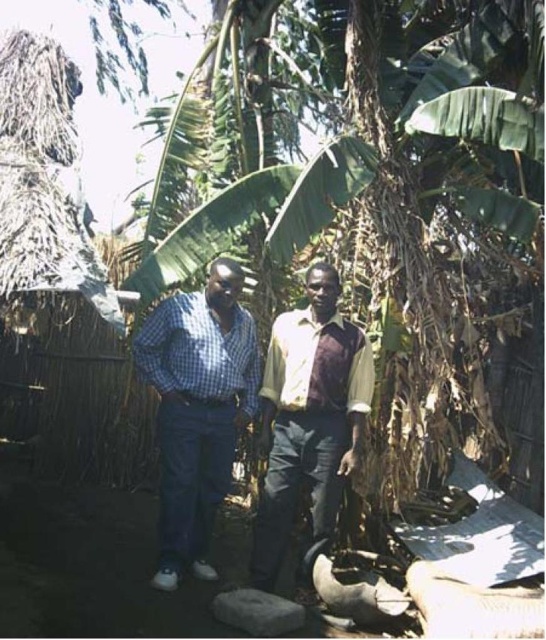
Question: Does checkered fabric shirt at center have a smaller size compared to light brown fabric shirt at center?

Choices:
 (A) no
 (B) yes

Answer: (A)

Question: Can you confirm if checkered fabric shirt at center is positioned to the right of light brown fabric shirt at center?

Choices:
 (A) yes
 (B) no

Answer: (B)

Question: Which point appears farthest from the camera in this image?

Choices:
 (A) (292, 387)
 (B) (139, 337)

Answer: (B)

Question: Is checkered fabric shirt at center above light brown fabric shirt at center?

Choices:
 (A) no
 (B) yes

Answer: (B)